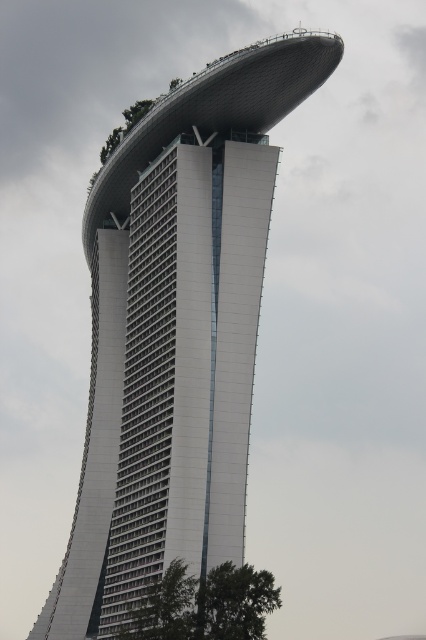
Does white glass tower at center have a smaller size compared to green leafy tree at lower right?

Incorrect, white glass tower at center is not smaller in size than green leafy tree at lower right.

Is point (239, 138) more distant than point (259, 618)?

Yes, point (239, 138) is behind point (259, 618).

The width and height of the screenshot is (426, 640). I want to click on white glass tower at center, so click(175, 330).